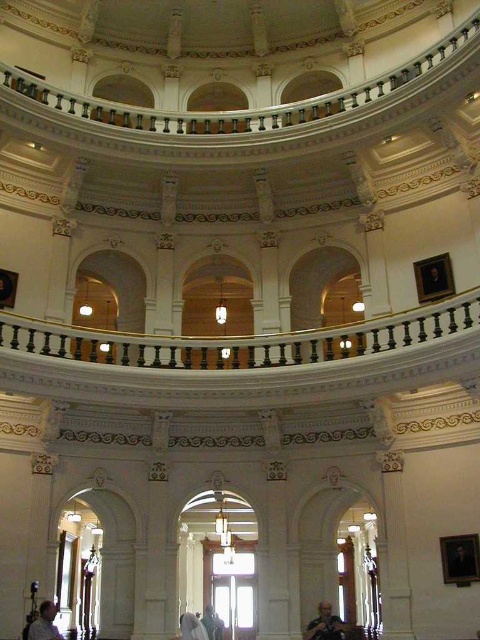
In the scene shown: Is gray fabric jacket at lower center smaller than light brown wooden chair at lower left?

Yes, gray fabric jacket at lower center is smaller than light brown wooden chair at lower left.

Find the location of a particular element. The image size is (480, 640). gray fabric jacket at lower center is located at coordinates pyautogui.click(x=324, y=625).

Is point (326, 632) farther from viewer compared to point (36, 630)?

Yes, point (326, 632) is farther from viewer.

At what (x,y) coordinates should I click in order to perform the action: click on gray fabric jacket at lower center. Please return your answer as a coordinate pair (x, y). Image resolution: width=480 pixels, height=640 pixels. Looking at the image, I should click on (324, 625).